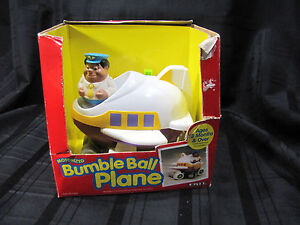
Identify the location of window. The height and width of the screenshot is (225, 300). (117, 118), (130, 118), (151, 122).